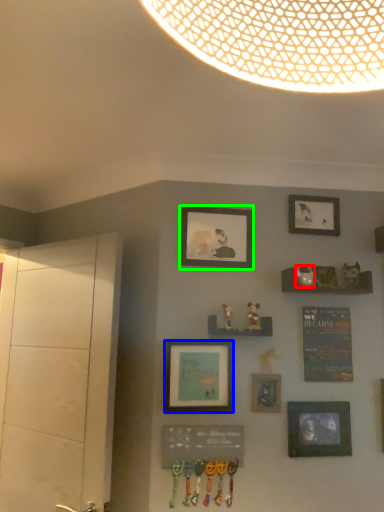
Question: Estimate the real-world distances between objects in this image. Which object is farther from art (highlighted by a red box), picture frame (highlighted by a blue box) or picture frame (highlighted by a green box)?

Choices:
 (A) picture frame
 (B) picture frame

Answer: (A)